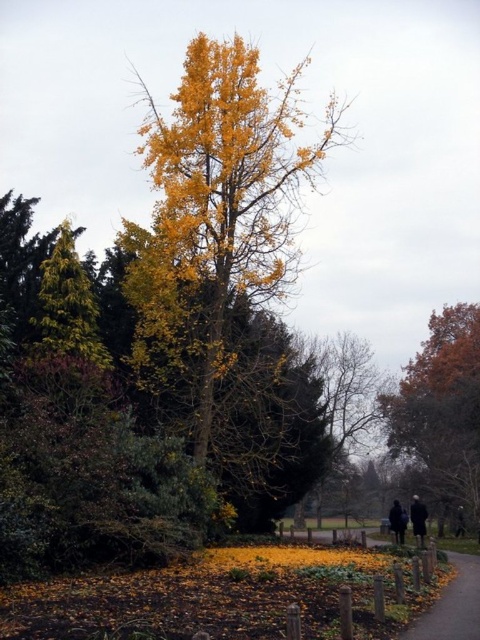
Does point (451, 474) come behind point (420, 529)?

Yes, it is behind point (420, 529).

Image resolution: width=480 pixels, height=640 pixels. I want to click on orange matte tree at lower right, so click(x=442, y=408).

Is point (434, 339) more distant than point (416, 515)?

Yes, it is behind point (416, 515).

Where is `orange matte tree at lower right`? Image resolution: width=480 pixels, height=640 pixels. orange matte tree at lower right is located at coordinates (442, 408).

Between orange matte tree at lower right and paved asphalt path at lower center, which one appears on the right side from the viewer's perspective?

orange matte tree at lower right

Does orange matte tree at lower right have a greater width compared to paved asphalt path at lower center?

Yes, orange matte tree at lower right is wider than paved asphalt path at lower center.

Between point (395, 432) and point (460, 572), which one is positioned behind?

Point (395, 432)

At what (x,y) coordinates should I click in order to perform the action: click on orange matte tree at lower right. Please return your answer as a coordinate pair (x, y). Looking at the image, I should click on (442, 408).

Consider the image. Which is above, paved asphalt path at lower center or dark gray jacket at lower right?

paved asphalt path at lower center is above.

Locate an element on the screen. The width and height of the screenshot is (480, 640). paved asphalt path at lower center is located at coordinates (453, 605).